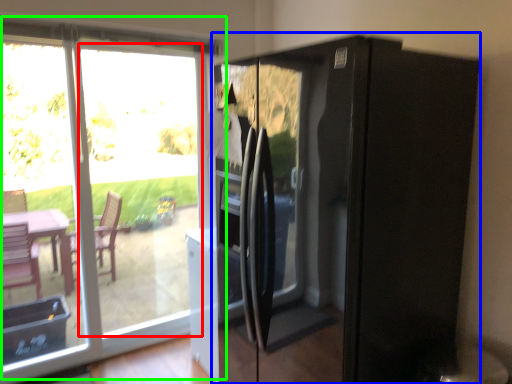
Question: Based on their relative distances, which object is nearer to glass door (highlighted by a red box)? Choose from appliance (highlighted by a blue box) and window (highlighted by a green box).

Choices:
 (A) appliance
 (B) window

Answer: (B)